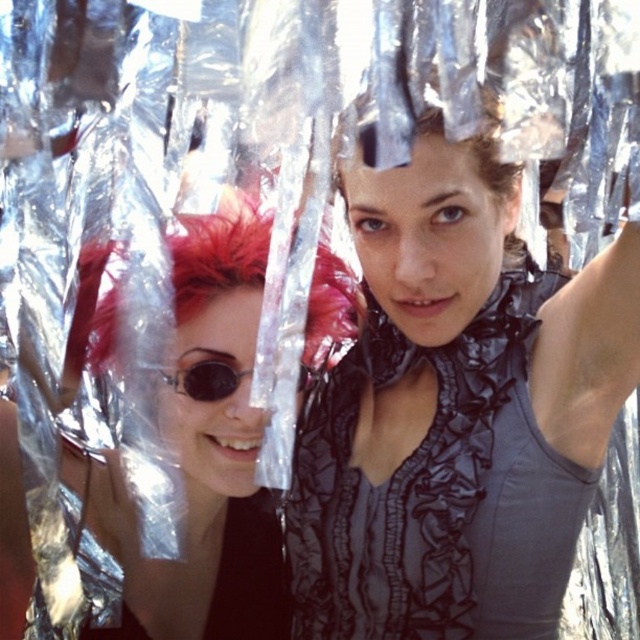
You are a fashion designer who wants to showcase the matte black dress at center in a runway show. The runway has a 1.2 meter clearance between the front edge and the first row of seats. Will the dress be visible to the audience when displayed at its current position?

The matte black dress at center is 73.36 centimeters from the viewer, which is less than the 1.2 meter clearance required. Therefore, the dress will be visible to the audience as it is within the safe distance.

From the picture: You are a photographer trying to capture a clear shot of the shiny red hair at left and the person on the right. Given that your camera lens has a maximum focus range of 80 centimeters, can you capture both subjects in focus without moving the camera or subjects?

The subjects are 83.08 centimeters apart, which exceeds the camera lens maximum focus range of 80 centimeters. Therefore, you cannot capture both the shiny red hair at left and the person on the right in focus without adjusting the camera or moving the subjects.

You are a photographer trying to capture a closeup shot of the vivid red hair at center and the sunglasses at center. Which object will require a wider angle to capture in full frame?

The vivid red hair at center requires a wider angle because its width surpasses that of the sunglasses at center.